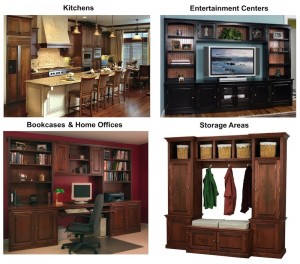
This screenshot has height=264, width=300. Find the location of `television`. television is located at coordinates pos(232,62).